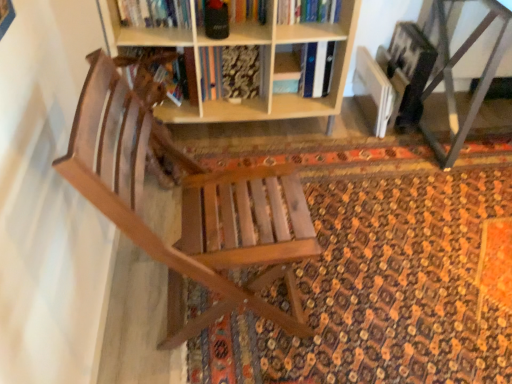
This screenshot has width=512, height=384. I want to click on vacant space in patterned carpet at center (from a real-world perspective), so click(407, 236).